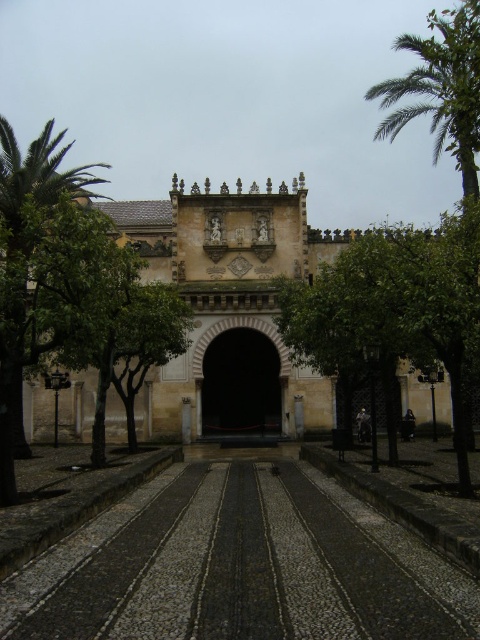
You are standing in front of the grand historical building and want to walk towards the entrance. Which object, the black textured pavement at center or the stone archway at center, will you step onto first?

The black textured pavement at center is smaller than the stone archway at center, so you will step onto the black textured pavement at center first as it is closer to your current position.

You are a tourist standing at the entrance of the historical building and want to take a photo that includes both the green leafy tree at center and the green leafy palm tree at upper right. Given their sizes, which tree should you frame closer to the center of your photo to ensure both are visible?

The green leafy tree at center is larger in size than the green leafy palm tree at upper right. To ensure both are visible in the photo, frame the green leafy tree at center closer to the center of your photo since it is larger and might require more space to capture its full form.